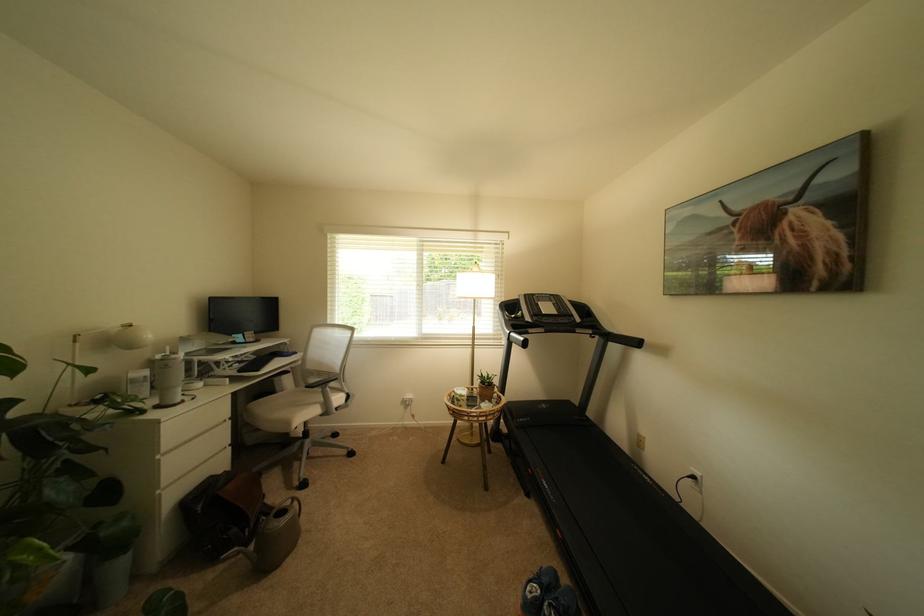
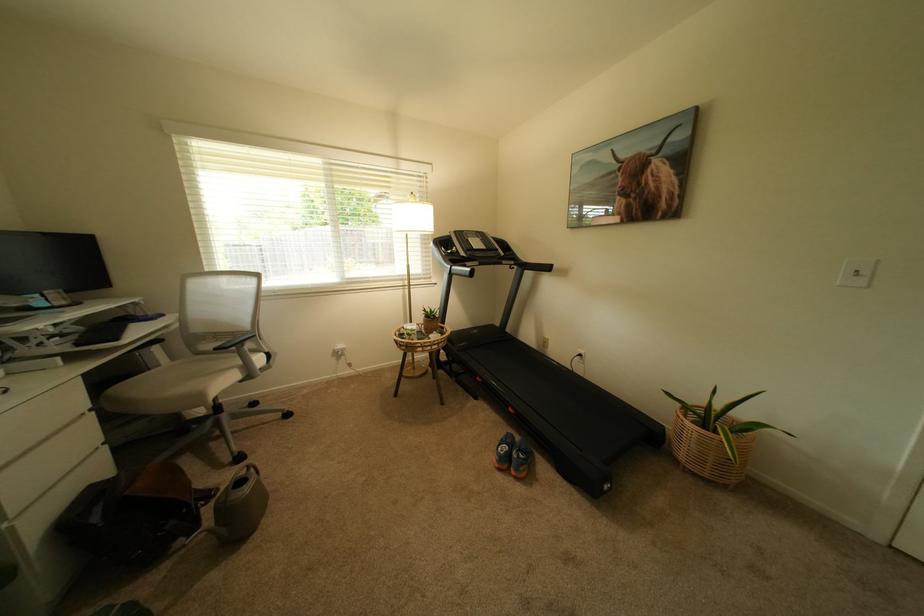
Question: In a continuous first-person perspective shot, in which direction is the camera moving?

Choices:
 (A) Left
 (B) Right
 (C) Forward
 (D) Backward

Answer: (A)